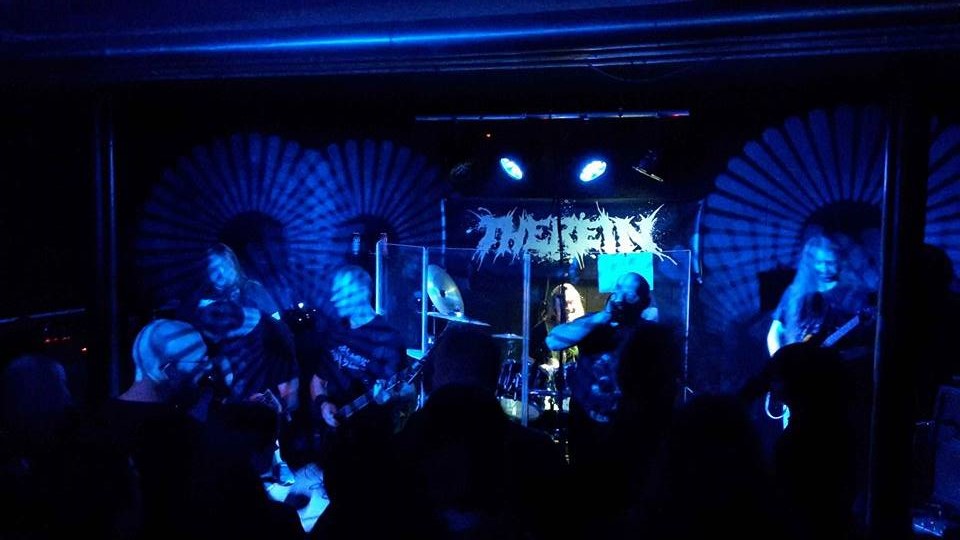
In order to click on light in this screenshot , I will do `click(511, 167)`, `click(588, 168)`.